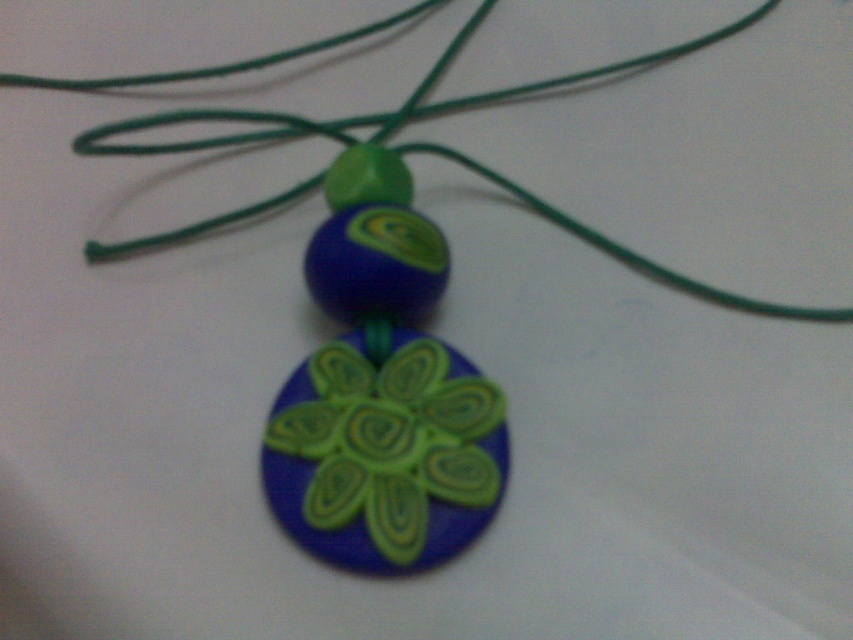
You are a jewelry designer holding a ruler. You want to measure the distance between the matte green clay flower at center and the viewer. Can you determine how far apart they are?

The matte green clay flower at center and viewer are 1.27 meters apart from each other.

You are an artisan examining a handmade necklace. You notice the matte green clay flower at center and the green cord at center. From your perspective, which object is positioned to the left?

The matte green clay flower at center is to the left of the green cord at center.

You are designing a necklace and have two points marked on your design blueprint. The first point is at coordinate point(347, 369) and the second is at point(161, 243). According to the image, which point is closer to the viewer?

Point(347, 369) is in front of point(161, 243), so it is closer to the viewer.